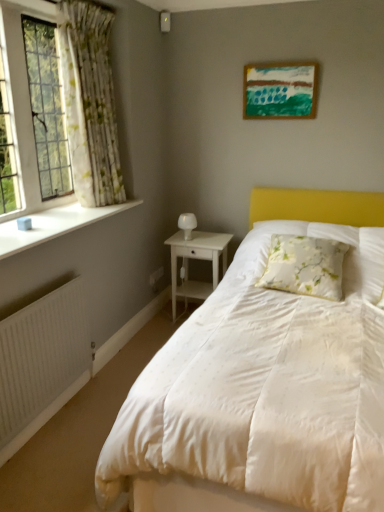
Locate an element on the screen. The width and height of the screenshot is (384, 512). free area below clear glass window at left (from a real-world perspective) is located at coordinates (50, 208).